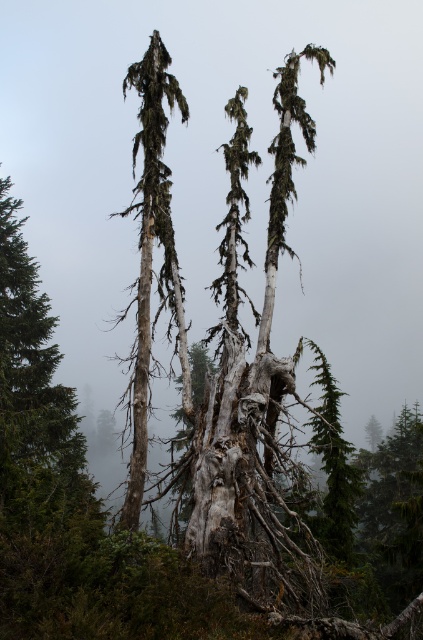
In the scene shown: You are an explorer navigating through the misty forest. You see the gray bark tree at center and the green textured pine tree at center. Which tree would appear larger in your view?

The gray bark tree at center appears larger because it is closer to the viewer than the green textured pine tree at center.

You are a hiker trying to navigate through the misty forest. You see the gray bark tree at center and the green textured pine tree at center. Which tree is positioned higher in the image?

The gray bark tree at center is positioned higher than the green textured pine tree at center.